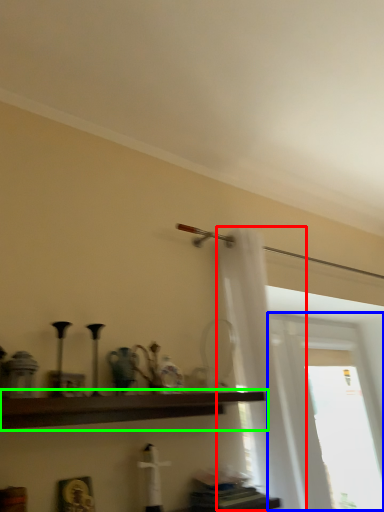
Question: Based on their relative distances, which object is farther from shower curtain (highlighted by a red box)? Choose from window (highlighted by a blue box) and shelf (highlighted by a green box).

Choices:
 (A) window
 (B) shelf

Answer: (A)